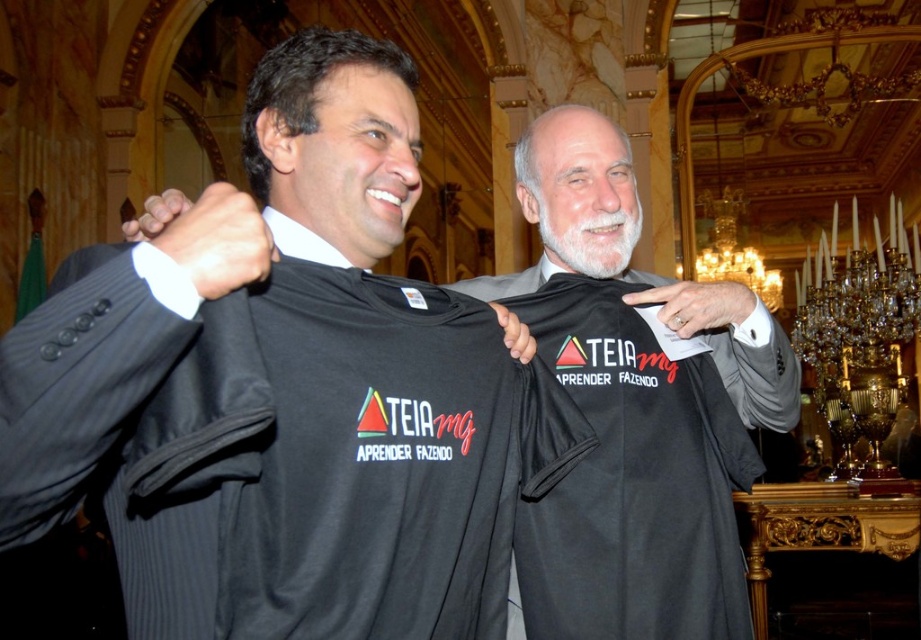
Based on the scene description, which object is positioned higher between the black fabric shirt at center and the black matte shirt at center?

The black fabric shirt at center is located above the black matte shirt at center.